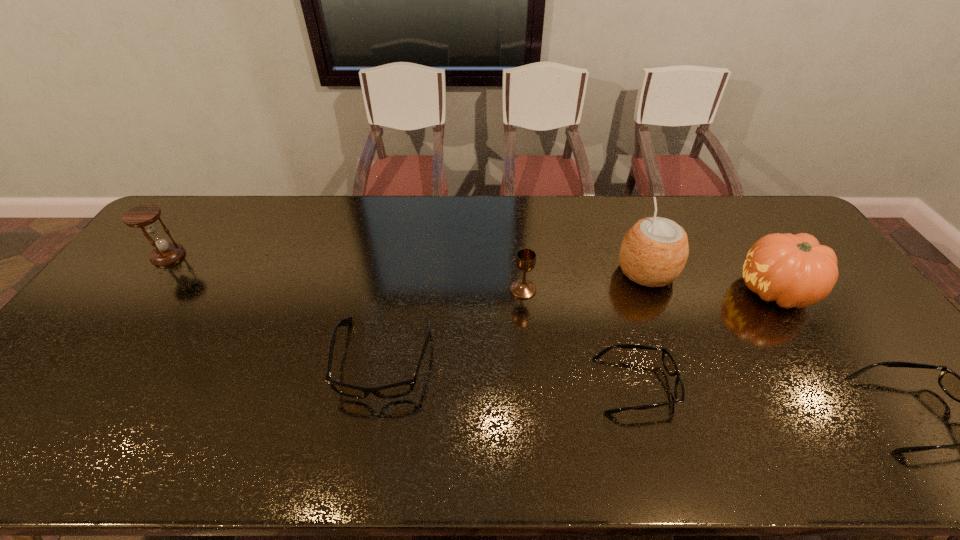
Where is `spectacles that is the second closest to the shortest object`? This screenshot has height=540, width=960. spectacles that is the second closest to the shortest object is located at coordinates (959, 388).

Locate which spectacles is the closest to the shortest object. Please provide its 2D coordinates. Your answer should be formatted as a tuple, i.e. [(x, y)], where the tuple contains the x and y coordinates of a point satisfying the conditions above.

[(400, 389)]

Where is `free space that satisfies the following two spatial constraints: 1. on the back side of the fifth object from right to left; 2. on the right side of the tallest object`? free space that satisfies the following two spatial constraints: 1. on the back side of the fifth object from right to left; 2. on the right side of the tallest object is located at coordinates (521, 272).